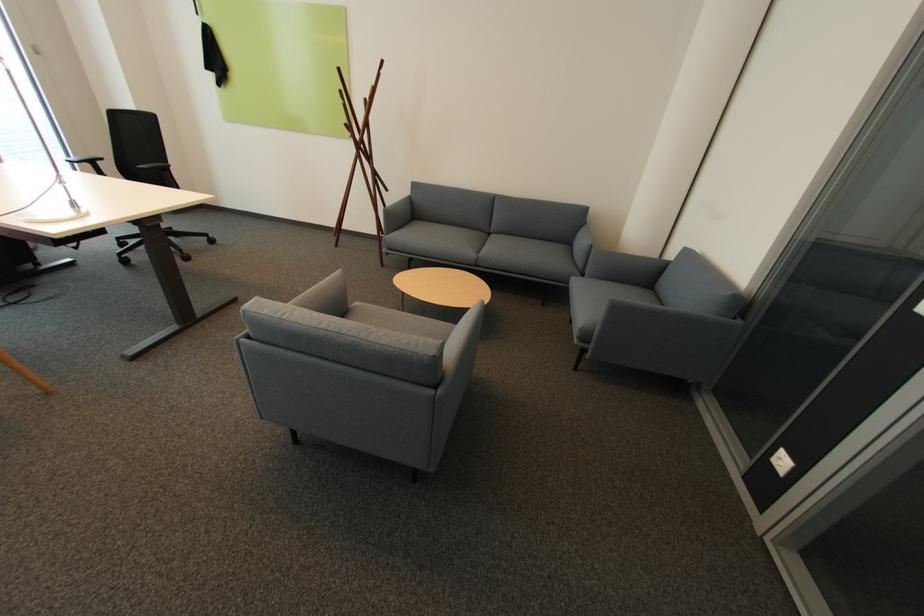
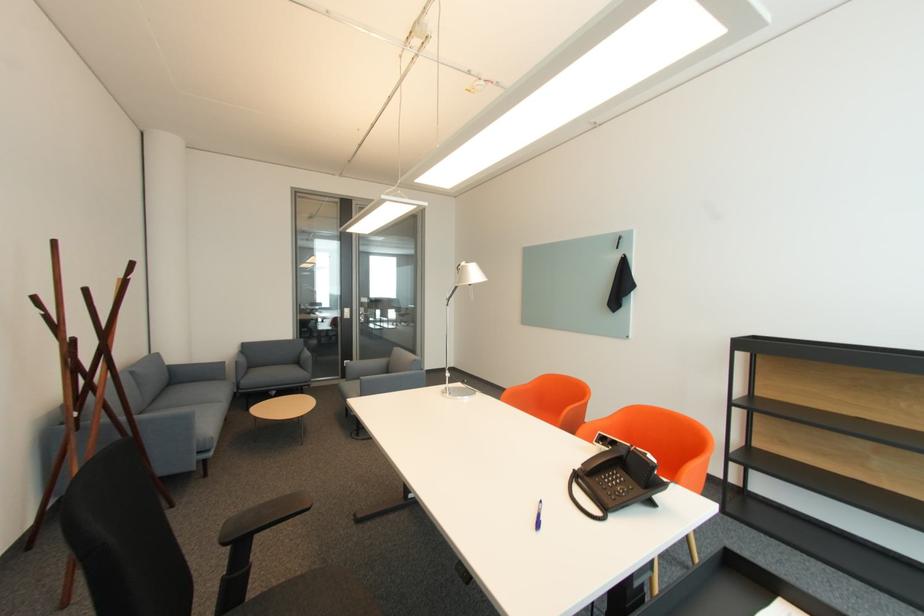
Locate, in the second image, the point that corresponds to [495,233] in the first image.

(151, 411)